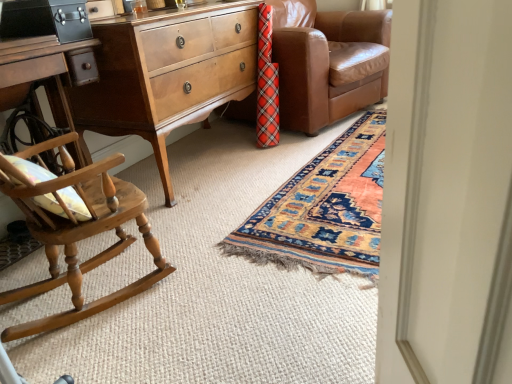
Question: From a real-world perspective, is brown leather couch at center located beneath black leather briefcase at upper left?

Choices:
 (A) yes
 (B) no

Answer: (A)

Question: Is brown leather couch at center to the right of black leather briefcase at upper left from the viewer's perspective?

Choices:
 (A) yes
 (B) no

Answer: (A)

Question: Considering the relative sizes of brown leather couch at center and black leather briefcase at upper left in the image provided, is brown leather couch at center taller than black leather briefcase at upper left?

Choices:
 (A) no
 (B) yes

Answer: (B)

Question: Is the depth of brown leather couch at center less than that of black leather briefcase at upper left?

Choices:
 (A) yes
 (B) no

Answer: (B)

Question: Can you confirm if brown leather couch at center is smaller than black leather briefcase at upper left?

Choices:
 (A) yes
 (B) no

Answer: (B)

Question: From the image's perspective, is light brown wood nightstand at left above or below wooden rocking chair at left?

Choices:
 (A) above
 (B) below

Answer: (A)

Question: Is light brown wood nightstand at left in front of or behind wooden rocking chair at left in the image?

Choices:
 (A) front
 (B) behind

Answer: (B)

Question: Looking at the image, does light brown wood nightstand at left seem bigger or smaller compared to wooden rocking chair at left?

Choices:
 (A) small
 (B) big

Answer: (B)

Question: Would you say light brown wood nightstand at left is inside or outside wooden rocking chair at left?

Choices:
 (A) inside
 (B) outside

Answer: (B)

Question: From the image's perspective, is light brown wood nightstand at left above or below brown leather couch at center?

Choices:
 (A) below
 (B) above

Answer: (A)

Question: In the image, is light brown wood nightstand at left positioned in front of or behind brown leather couch at center?

Choices:
 (A) behind
 (B) front

Answer: (B)

Question: From a real-world perspective, relative to brown leather couch at center, is light brown wood nightstand at left vertically above or below?

Choices:
 (A) below
 (B) above

Answer: (A)

Question: Is light brown wood nightstand at left inside or outside of brown leather couch at center?

Choices:
 (A) inside
 (B) outside

Answer: (B)

Question: In terms of size, does brown leather couch at center appear bigger or smaller than wooden rocking chair at left?

Choices:
 (A) big
 (B) small

Answer: (A)

Question: Does point (294, 84) appear closer or farther from the camera than point (143, 198)?

Choices:
 (A) closer
 (B) farther

Answer: (B)